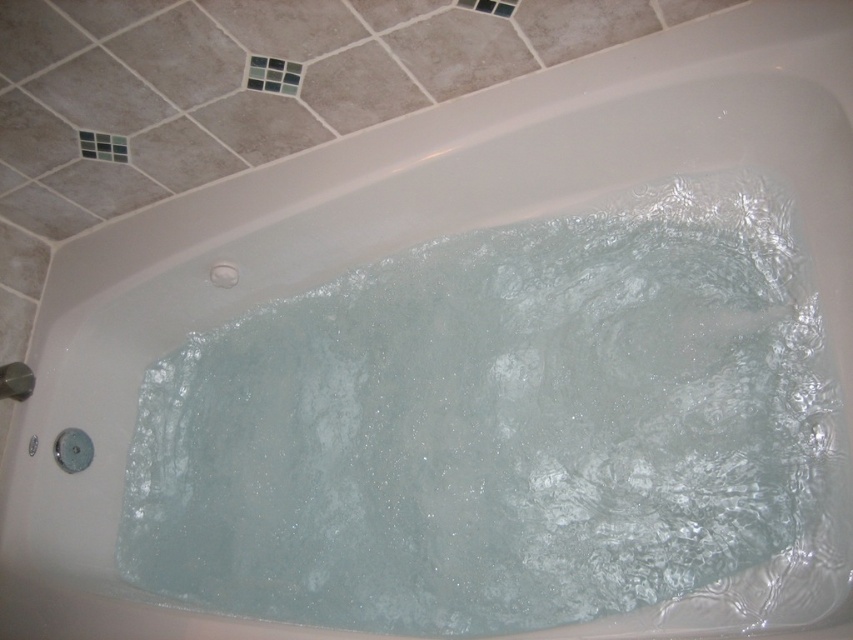
Does clear glass tile at upper center lie behind brushed metal shower at lower left?

No.

Identify the location of clear glass tile at upper center. Image resolution: width=853 pixels, height=640 pixels. (273, 76).

This screenshot has height=640, width=853. Find the location of `clear glass tile at upper center`. clear glass tile at upper center is located at coordinates pyautogui.click(x=273, y=76).